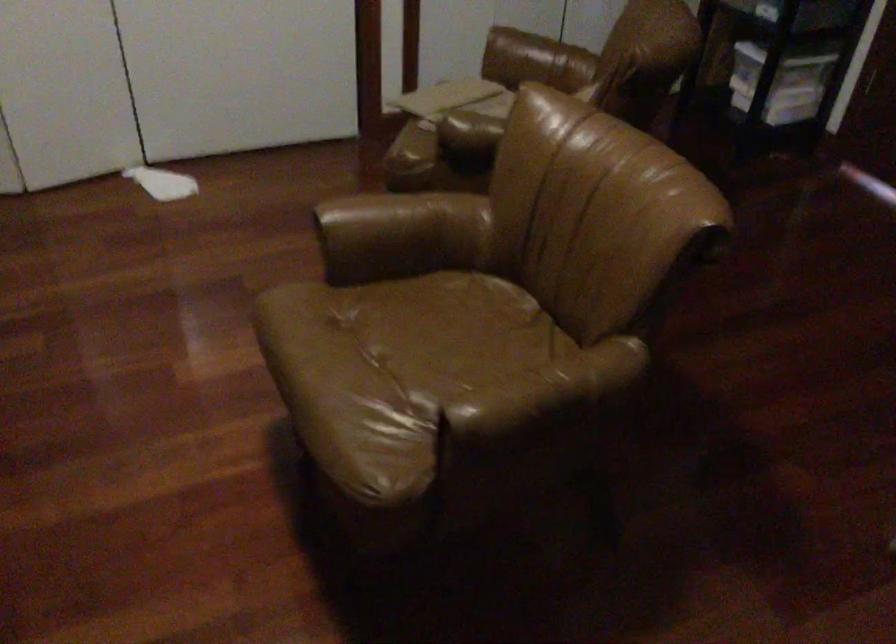
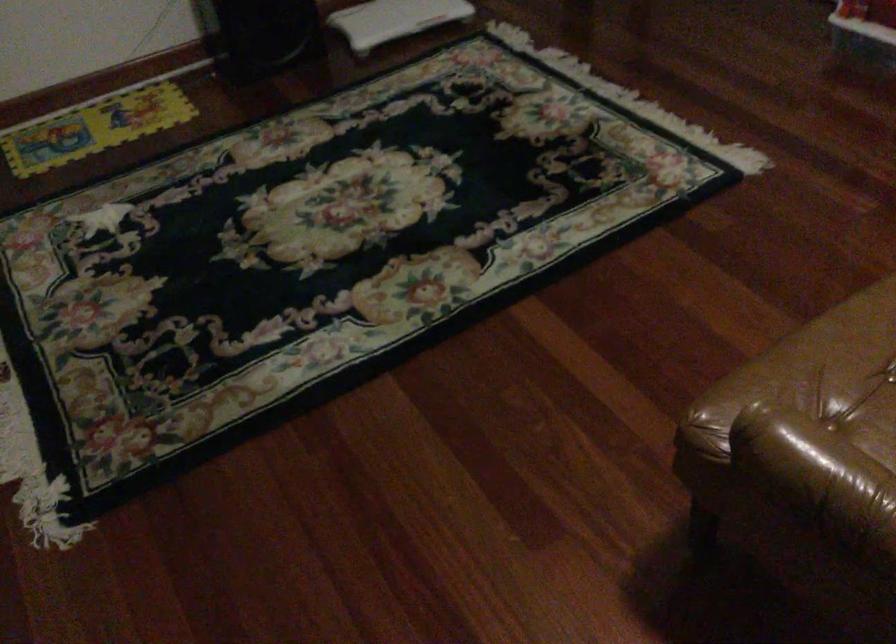
How did the camera likely rotate?

The rotation direction of the camera is left-down.